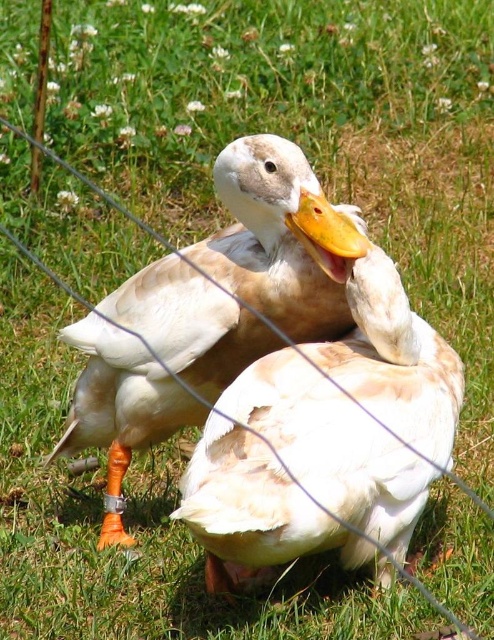
Which is behind, point (389, 440) or point (309, 333)?

The point (309, 333) is more distant.

Which is more to the right, white matte duck at center or white feathered goose at center?

white matte duck at center

Who is more distant from viewer, (454,378) or (256,150)?

The point (454,378) is behind.

Where is `white matte duck at center`? This screenshot has height=640, width=494. white matte duck at center is located at coordinates (332, 445).

Is white feathered goose at center positioned in front of yellow matte beak at center?

No, white feathered goose at center is further to the viewer.

From the picture: Between white feathered goose at center and yellow matte beak at center, which one is positioned higher?

yellow matte beak at center

Is point (224, 298) closer to viewer compared to point (306, 230)?

No, (224, 298) is behind (306, 230).

Identify the location of white feathered goose at center. Image resolution: width=494 pixels, height=640 pixels. (x=280, y=240).

Does white matte duck at center have a greater height compared to yellow matte beak at center?

Correct, white matte duck at center is much taller as yellow matte beak at center.

Is white matte duck at center to the right of yellow matte beak at center from the viewer's perspective?

Incorrect, white matte duck at center is not on the right side of yellow matte beak at center.

In order to click on white matte duck at center in this screenshot , I will do `click(332, 445)`.